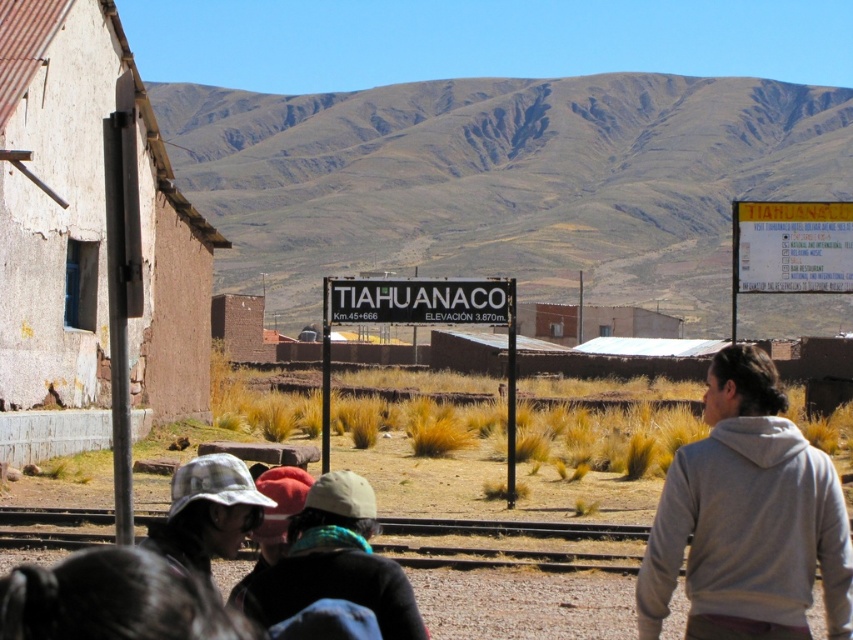
You are a visitor at Tiahuanaco and want to read the white paper sign at upper right. However, your plaid fabric hat at lower left is blocking your view. Can you tell me which object is taller so you know how to adjust your position?

The white paper sign at upper right is not as tall as the plaid fabric hat at lower left, so the plaid fabric hat at lower left is taller. To read the sign, you might need to lower your hat or move it aside to see the white paper sign at upper right clearly.

What are the coordinates of the white plastic sign at center?

The white plastic sign at center is located at coordinates point (421, 323).